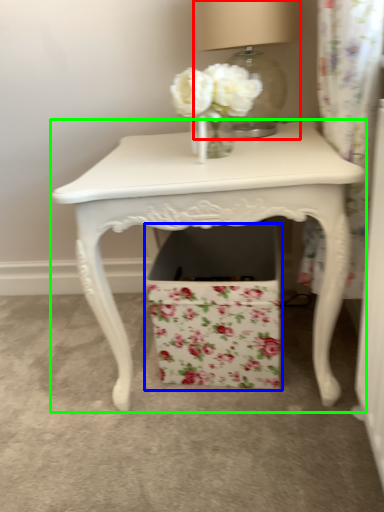
Question: Based on their relative distances, which object is farther from table lamp (highlighted by a red box)? Choose from cardboard box (highlighted by a blue box) and table (highlighted by a green box).

Choices:
 (A) cardboard box
 (B) table

Answer: (A)